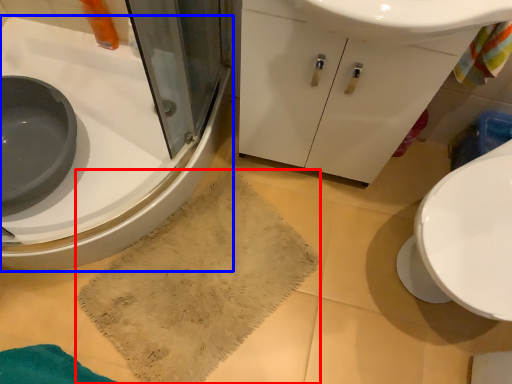
Question: Which object is further to the camera taking this photo, bath towel (highlighted by a red box) or sink (highlighted by a blue box)?

Choices:
 (A) bath towel
 (B) sink

Answer: (A)